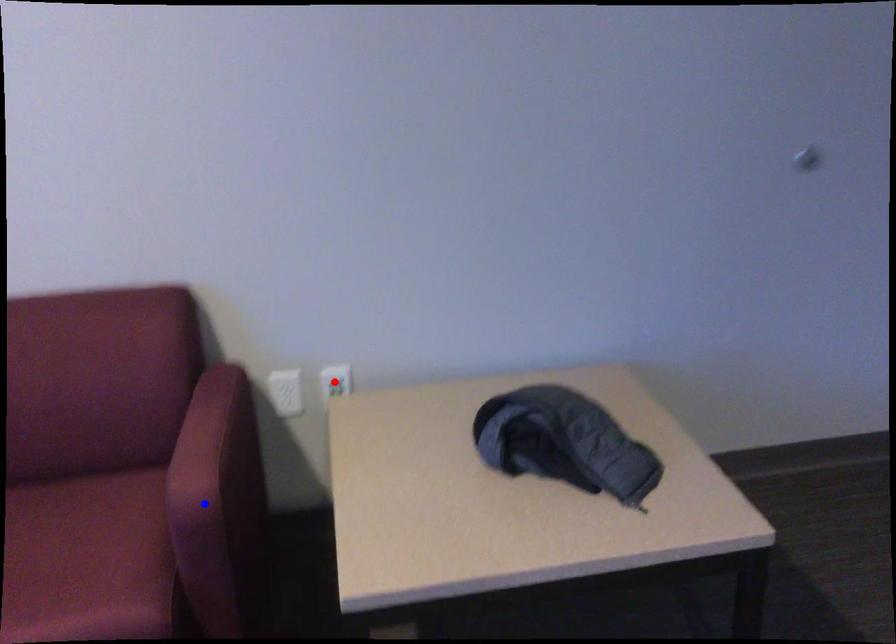
Question: Which of the two points in the image is closer to the camera?

Choices:
 (A) Blue point is closer.
 (B) Red point is closer.

Answer: (A)